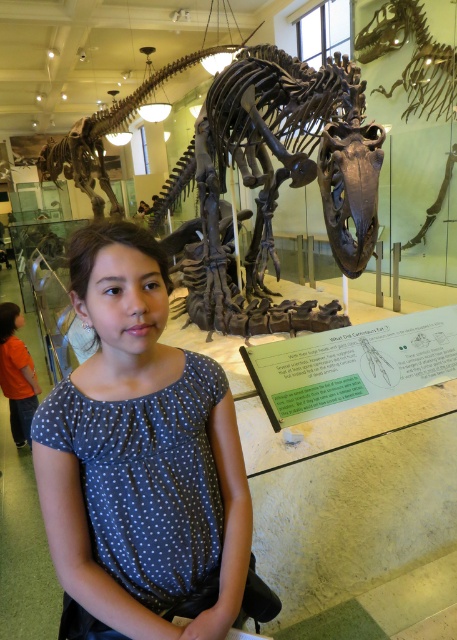
Question: Which point appears farthest from the camera in this image?

Choices:
 (A) (416, 240)
 (B) (107, 532)

Answer: (A)

Question: Is polka dot fabric shirt at center below orange shirt at left?

Choices:
 (A) yes
 (B) no

Answer: (B)

Question: Which of the following is the closest to the observer?

Choices:
 (A) (371, 170)
 (B) (446, 104)

Answer: (A)

Question: Is shiny metallic skull at upper right further to the viewer compared to shiny metallic dinosaur at center?

Choices:
 (A) yes
 (B) no

Answer: (B)

Question: Is orange shirt at left positioned behind shiny metallic dinosaur at center?

Choices:
 (A) yes
 (B) no

Answer: (B)

Question: Which object is the closest to the shiny metallic skull at upper right?

Choices:
 (A) orange shirt at left
 (B) polka dot fabric shirt at center
 (C) shiny metallic dinosaur skeleton at center
 (D) shiny metallic dinosaur at center

Answer: (D)